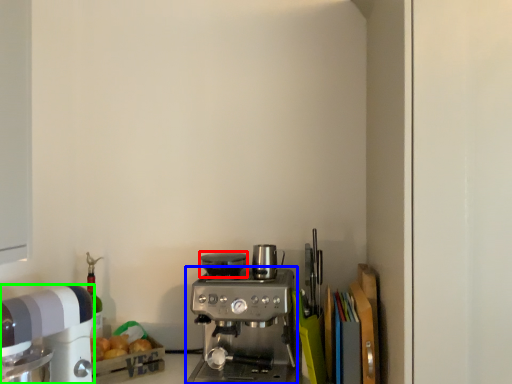
Question: Which is farther away from appliance (highlighted by a red box)? coffee maker (highlighted by a blue box) or kitchen appliance (highlighted by a green box)?

Choices:
 (A) coffee maker
 (B) kitchen appliance

Answer: (B)